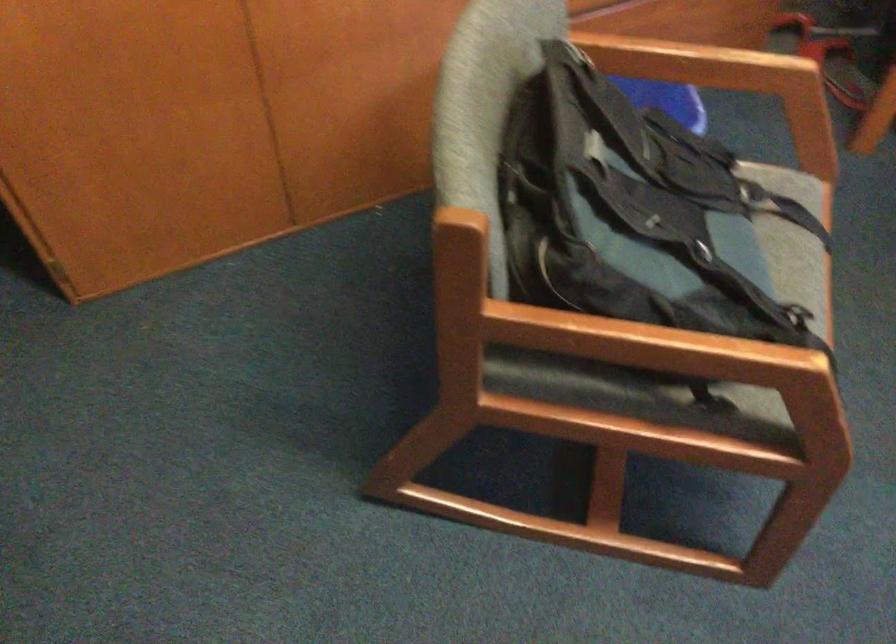
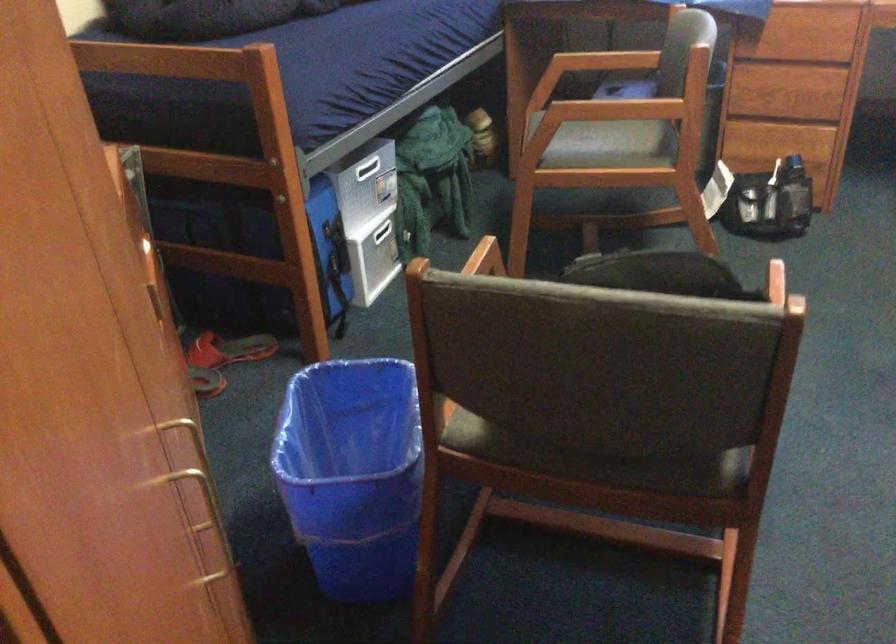
Where in the second image is the point corresponding to pixel 807 106 from the first image?

(487, 257)